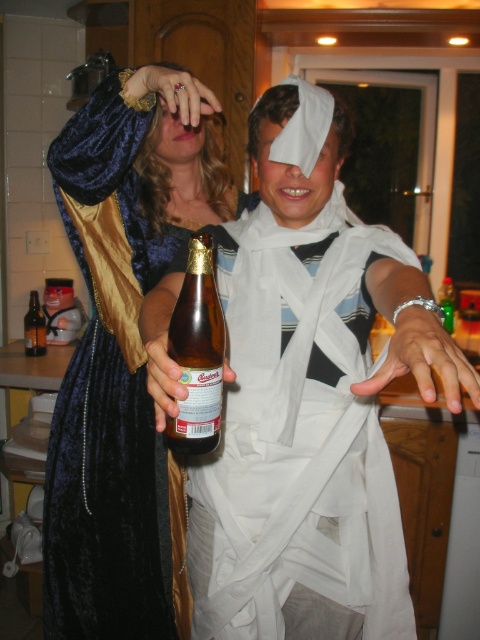
You are organizing a costume party and need to decide which item takes up more space on a display table. Based on the image, which object is larger between the velvet dress at center and the brown glass bottle at center?

The velvet dress at center is bigger than the brown glass bottle at center, so the velvet dress at center takes up more space on the display table.